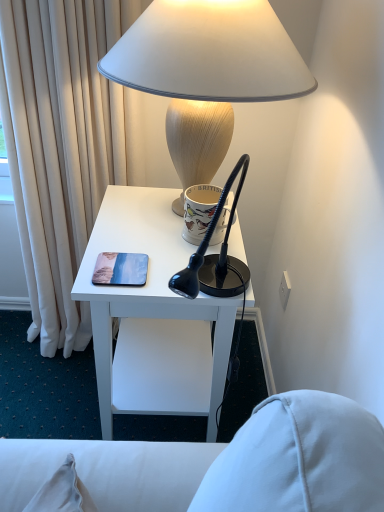
Question: From the image's perspective, is white glossy desk at center above white matte lampshade at upper center?

Choices:
 (A) yes
 (B) no

Answer: (B)

Question: Can you confirm if white glossy desk at center is positioned to the right of white matte lampshade at upper center?

Choices:
 (A) yes
 (B) no

Answer: (B)

Question: From a real-world perspective, does white glossy desk at center stand above white matte lampshade at upper center?

Choices:
 (A) no
 (B) yes

Answer: (A)

Question: Can you confirm if white glossy desk at center is wider than white matte lampshade at upper center?

Choices:
 (A) yes
 (B) no

Answer: (B)

Question: Does white glossy desk at center have a larger size compared to white matte lampshade at upper center?

Choices:
 (A) no
 (B) yes

Answer: (B)

Question: Would you say white matte lampshade at upper center is to the left or to the right of white glossy desk at center in the picture?

Choices:
 (A) right
 (B) left

Answer: (A)

Question: From a real-world perspective, is white matte lampshade at upper center positioned above or below white glossy desk at center?

Choices:
 (A) below
 (B) above

Answer: (B)

Question: Is white matte lampshade at upper center wider or thinner than white glossy desk at center?

Choices:
 (A) thin
 (B) wide

Answer: (B)

Question: Considering the positions of white matte lampshade at upper center and white glossy desk at center in the image, is white matte lampshade at upper center bigger or smaller than white glossy desk at center?

Choices:
 (A) small
 (B) big

Answer: (A)

Question: Is white glossy desk at center taller or shorter than white ceramic mug at upper center?

Choices:
 (A) tall
 (B) short

Answer: (A)

Question: Considering the positions of white glossy desk at center and white ceramic mug at upper center in the image, is white glossy desk at center wider or thinner than white ceramic mug at upper center?

Choices:
 (A) wide
 (B) thin

Answer: (A)

Question: Would you say white glossy desk at center is to the left or to the right of white ceramic mug at upper center in the picture?

Choices:
 (A) right
 (B) left

Answer: (B)

Question: Is point (190, 247) positioned closer to the camera than point (195, 197)?

Choices:
 (A) farther
 (B) closer

Answer: (A)

Question: Looking at the image, does white matte lampshade at upper center seem bigger or smaller compared to white ceramic mug at upper center?

Choices:
 (A) big
 (B) small

Answer: (A)

Question: In terms of height, does white matte lampshade at upper center look taller or shorter compared to white ceramic mug at upper center?

Choices:
 (A) short
 (B) tall

Answer: (B)